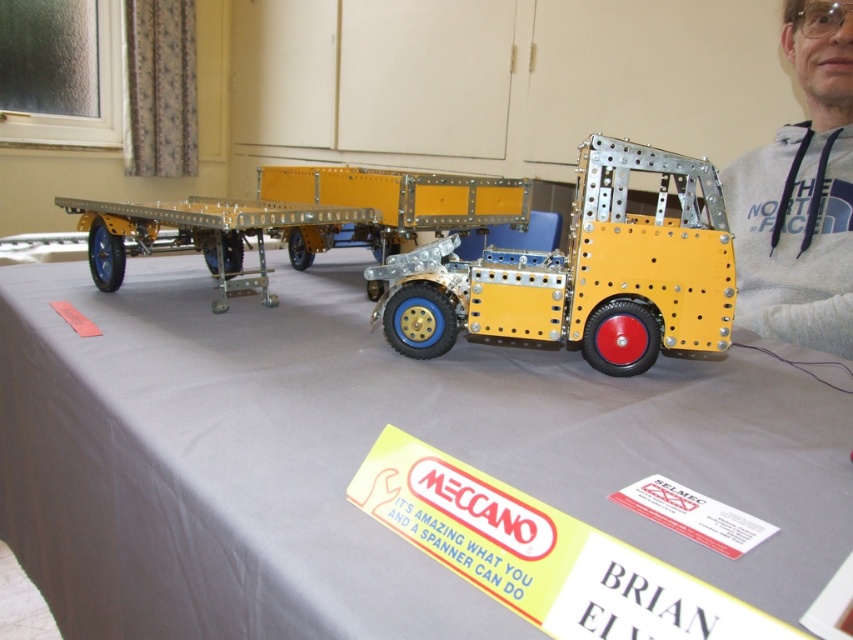
You are a model train enthusiast who wants to place a 75 cm long locomotive between the gray fabric at center and the gray fleece hoodie at upper right. Is there enough space for the locomotive to fit between them?

The distance between the gray fabric at center and the gray fleece hoodie at upper right is 76.95 centimeters. Since the locomotive is 75 cm long, there is enough space for it to fit between them with 1.95 centimeters to spare.

Based on the photo, you are an observer looking at the Meccano model display. There is a gray fleece hoodie at upper right and a metallic yellow trailer truck at center. Which object is placed higher in the image?

The gray fleece hoodie at upper right is positioned over the metallic yellow trailer truck at center, so it is placed higher in the image.

You are a robot trying to navigate between two points in the image. The first point is point (57, 317) and the second point is point (743, 276). Which point is closer to the observer?

Point (57, 317) is in front of point (743, 276), so it is closer to the observer.